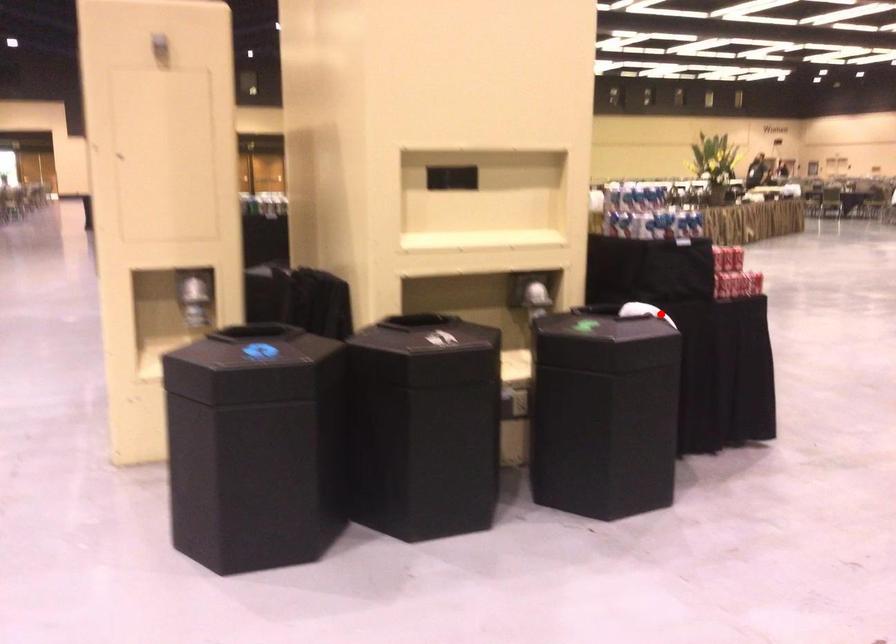
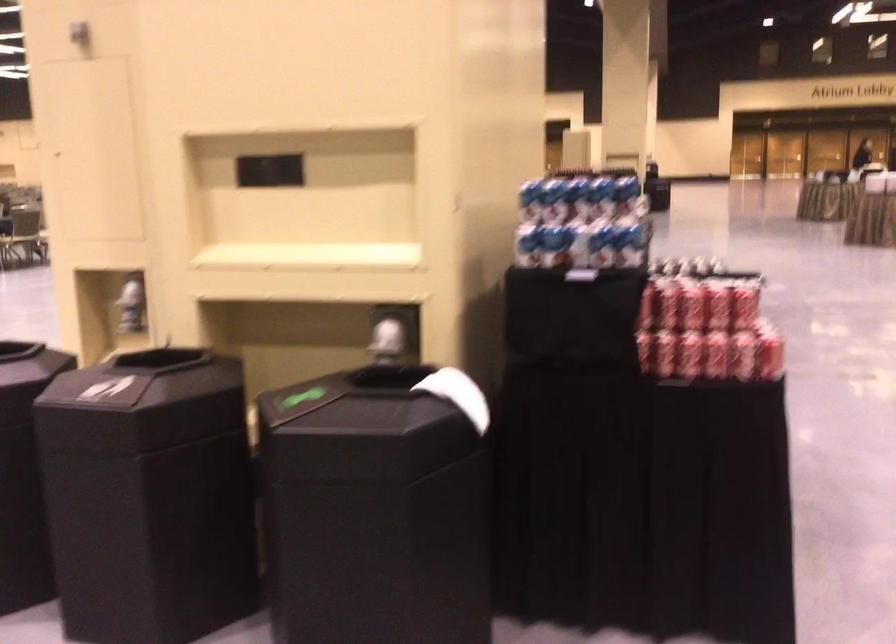
Question: I am providing you with two images of the same scene from different viewpoints. Image1 has a red point marked. In image2, the corresponding 3D location appears at what relative position? Reply with the corresponding letter.

Choices:
 (A) Closer
 (B) Farther

Answer: (A)